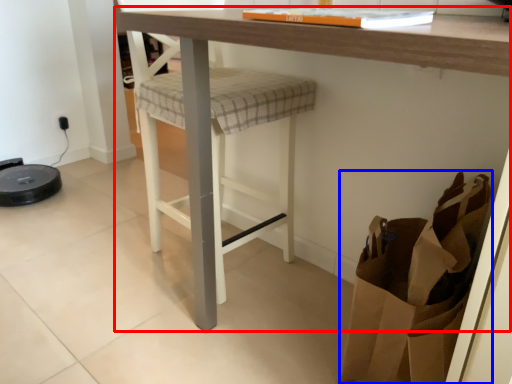
Question: Among these objects, which one is nearest to the camera, table (highlighted by a red box) or shopping bag (highlighted by a blue box)?

Choices:
 (A) table
 (B) shopping bag

Answer: (A)